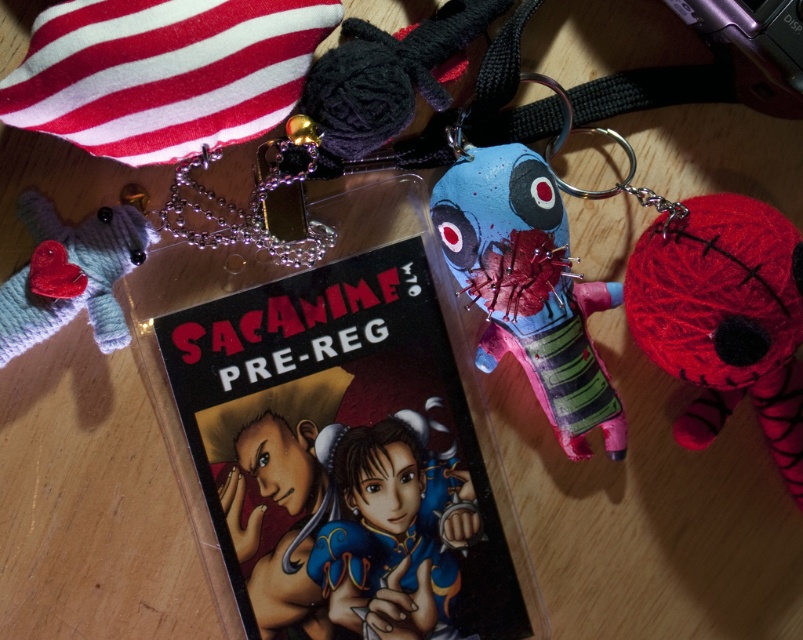
Question: Is yarn-like red plush toy at right to the left of matte blue plush toy at center from the viewer's perspective?

Choices:
 (A) yes
 (B) no

Answer: (B)

Question: Is yarn-like red plush toy at right to the left of knitted wool heart at left from the viewer's perspective?

Choices:
 (A) yes
 (B) no

Answer: (B)

Question: Which point is closer to the camera?

Choices:
 (A) yarn-like red plush toy at right
 (B) matte blue fabric doll at center
 (C) knitted wool heart at left

Answer: (A)

Question: Which is nearer to the matte blue fabric doll at center?

Choices:
 (A) yarn-like red plush toy at right
 (B) matte plastic book at center

Answer: (B)

Question: Which of the following is the farthest from the observer?

Choices:
 (A) (691, 218)
 (B) (556, 307)
 (C) (382, 557)
 (D) (60, 314)

Answer: (C)

Question: In this image, where is yarn-like red plush toy at right located relative to knitted wool heart at left?

Choices:
 (A) left
 (B) right

Answer: (B)